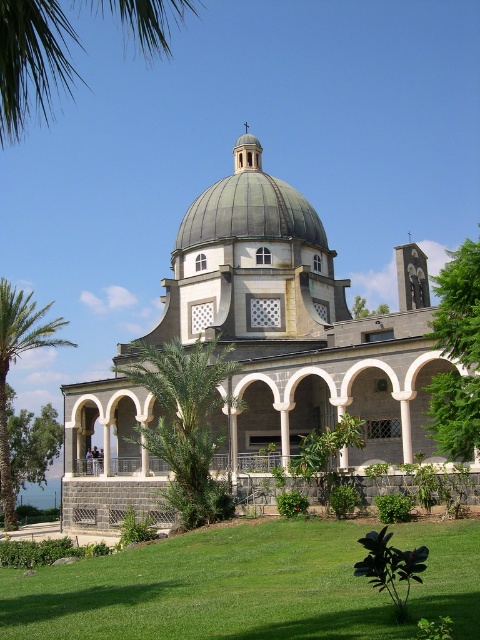
You are standing in front of the grand building and want to take a photo that includes both the green leafy palm tree at left and the green leafy tree at lower left. Which tree should you focus on to ensure both are in frame without moving your camera position?

You should focus on the green leafy palm tree at left because it is larger in size than the green leafy tree at lower left, so it will be more visible in the photo while still allowing the smaller tree to be captured in the frame.

You are standing in front of the grand structure and want to determine the relative positions of two points marked on the facade. Which point is closer to you, the point at coordinates point (x=253, y=157) or point (x=478, y=360)?

The point at coordinates point (x=253, y=157) is closer to you because it is further to the viewer than point (x=478, y=360).

You are standing in front of the grand building and want to take a photo that includes both the green leafy tree at right and the green leafy palm tree at left. Which tree should you position closer to the center of the frame to ensure both are fully visible?

You should position the green leafy palm tree at left closer to the center of the frame because it is taller than the green leafy tree at right, ensuring both are fully visible in the photo.